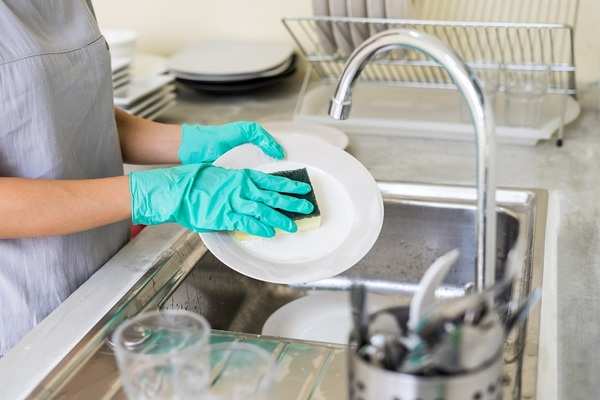
At what (x,y) coordinates should I click in order to perform the action: click on cutting board. Please return your answer as a coordinate pair (x, y). Looking at the image, I should click on (396, 105).